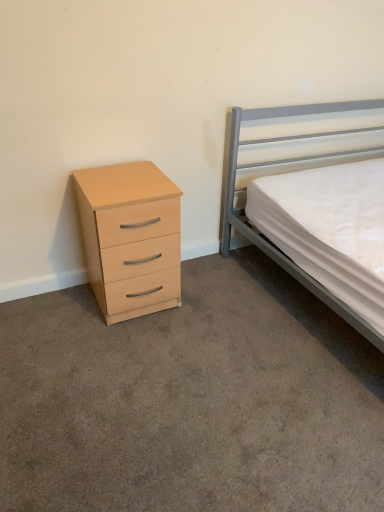
Question: Is matte wood chest of drawers at left at the back of metallic gray bed at right?

Choices:
 (A) yes
 (B) no

Answer: (B)

Question: Can you confirm if metallic gray bed at right is bigger than matte wood chest of drawers at left?

Choices:
 (A) yes
 (B) no

Answer: (A)

Question: Does metallic gray bed at right have a lesser height compared to matte wood chest of drawers at left?

Choices:
 (A) no
 (B) yes

Answer: (A)

Question: Is metallic gray bed at right outside matte wood chest of drawers at left?

Choices:
 (A) no
 (B) yes

Answer: (B)

Question: Would you say metallic gray bed at right contains matte wood chest of drawers at left?

Choices:
 (A) yes
 (B) no

Answer: (B)

Question: Is metallic gray bed at right facing towards matte wood chest of drawers at left?

Choices:
 (A) no
 (B) yes

Answer: (A)

Question: Would you say matte wood chest of drawers at left is outside metallic gray bed at right?

Choices:
 (A) no
 (B) yes

Answer: (B)

Question: Is matte wood chest of drawers at left far away from metallic gray bed at right?

Choices:
 (A) no
 (B) yes

Answer: (A)

Question: From the image's perspective, is matte wood chest of drawers at left above metallic gray bed at right?

Choices:
 (A) yes
 (B) no

Answer: (B)

Question: Does matte wood chest of drawers at left turn towards metallic gray bed at right?

Choices:
 (A) yes
 (B) no

Answer: (B)

Question: Does matte wood chest of drawers at left appear on the left side of metallic gray bed at right?

Choices:
 (A) no
 (B) yes

Answer: (B)

Question: From a real-world perspective, is matte wood chest of drawers at left below metallic gray bed at right?

Choices:
 (A) yes
 (B) no

Answer: (A)

Question: Considering the positions of matte wood chest of drawers at left and metallic gray bed at right in the image, is matte wood chest of drawers at left wider or thinner than metallic gray bed at right?

Choices:
 (A) wide
 (B) thin

Answer: (B)